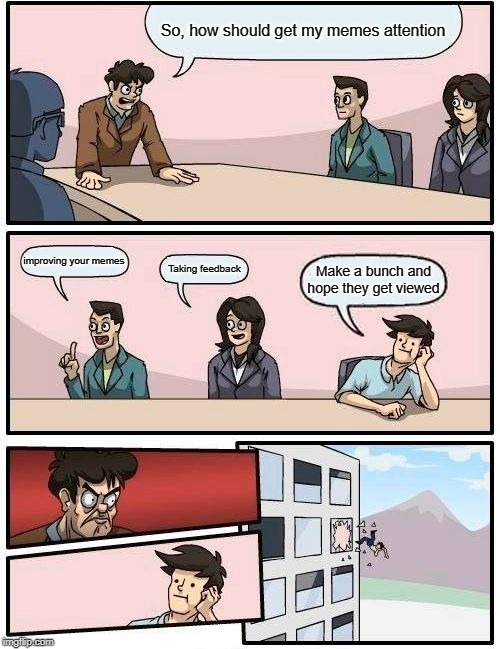
Where is `broken window`? broken window is located at coordinates (340, 532).